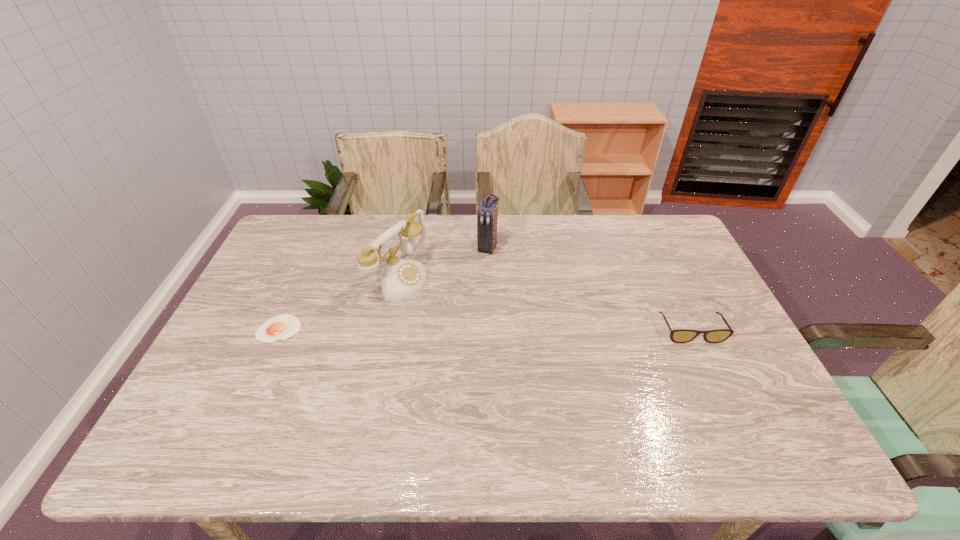
Where is `free spot at the left edge of the desktop`? The width and height of the screenshot is (960, 540). free spot at the left edge of the desktop is located at coordinates (293, 264).

In the image, there is a desktop. In order to click on free space at the right edge in this screenshot , I will do `click(703, 334)`.

Where is `free region at the near left corner of the desktop`? free region at the near left corner of the desktop is located at coordinates (204, 401).

You are a GUI agent. You are given a task and a screenshot of the screen. Output one action in this format:
    pyautogui.click(x=<x>, y=<y>)
    Task: Click on the vacant area at the far right corner of the desktop
    
    Given the screenshot: What is the action you would take?
    pyautogui.click(x=667, y=227)

You are a GUI agent. You are given a task and a screenshot of the screen. Output one action in this format:
    pyautogui.click(x=<x>, y=<y>)
    Task: Click on the vacant area at the near right corner of the desktop
    This screenshot has width=960, height=540.
    Given the screenshot: What is the action you would take?
    pyautogui.click(x=725, y=387)

Locate an element on the screen. This screenshot has width=960, height=540. free space between the sunglasses and the second object from right to left is located at coordinates (589, 288).

Locate an element on the screen. This screenshot has height=540, width=960. empty space between the third tallest object and the third object from right to left is located at coordinates (545, 303).

Where is `free space that is in between the second shortest object and the third object from right to left`? This screenshot has height=540, width=960. free space that is in between the second shortest object and the third object from right to left is located at coordinates (545, 303).

Identify the location of vacant area that lies between the second object from left to right and the clutch bag. (444, 261).

Where is `empty location between the egg yolk and the third object from right to left`? Image resolution: width=960 pixels, height=540 pixels. empty location between the egg yolk and the third object from right to left is located at coordinates (340, 302).